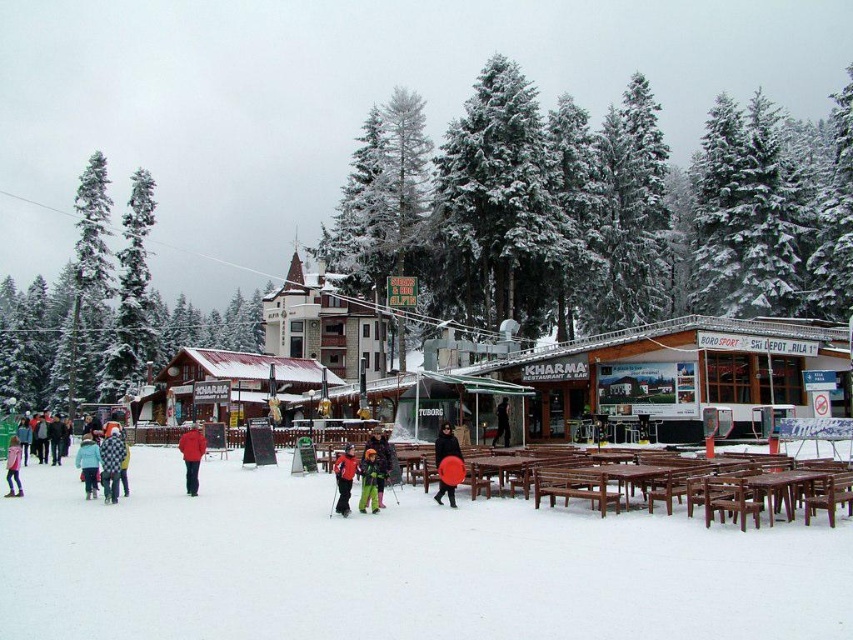
You are a photographer standing at the point marked as point (368, 481) in the image. You want to capture a photo of the green matte snow pants at center. Since you are exactly at that point, can you see the green matte snow pants at center in your current position?

Yes, since you are at point (368, 481) where the green matte snow pants at center is located, you can see the green matte snow pants at center in your current position.